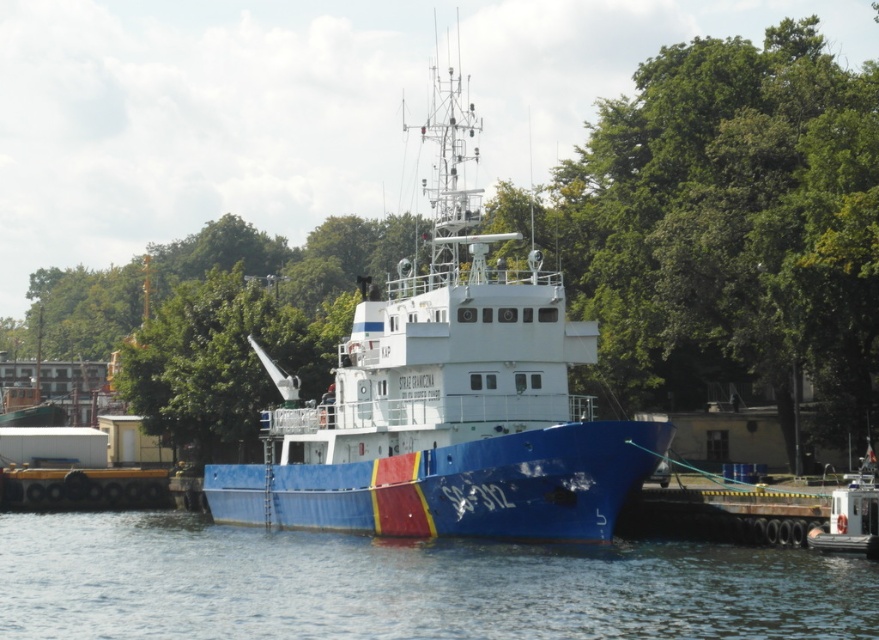
Does point (516, 592) lie behind point (265, 314)?

That is False.

Can you confirm if blue glossy water at lower center is positioned above green leafy tree at upper left?

Incorrect, blue glossy water at lower center is not positioned above green leafy tree at upper left.

Between point (771, 598) and point (231, 360), which one is positioned behind?

Point (231, 360)

Locate an element on the screen. The image size is (879, 640). blue glossy water at lower center is located at coordinates (405, 584).

Is blue matte boat at center to the left of blue glossy water at lower center from the viewer's perspective?

In fact, blue matte boat at center is to the right of blue glossy water at lower center.

Can you confirm if blue matte boat at center is positioned below blue glossy water at lower center?

No, blue matte boat at center is not below blue glossy water at lower center.

Is point (433, 500) in front of point (275, 632)?

That is False.

This screenshot has height=640, width=879. In order to click on blue matte boat at center in this screenshot , I will do `click(447, 397)`.

Can you confirm if blue matte boat at center is smaller than green leafy tree at upper left?

No, blue matte boat at center is not smaller than green leafy tree at upper left.

Is blue matte boat at center bigger than green leafy tree at upper left?

Yes.

Which is in front, point (546, 316) or point (184, 289)?

Point (546, 316) is in front.

Identify the location of blue matte boat at center. The height and width of the screenshot is (640, 879). (447, 397).